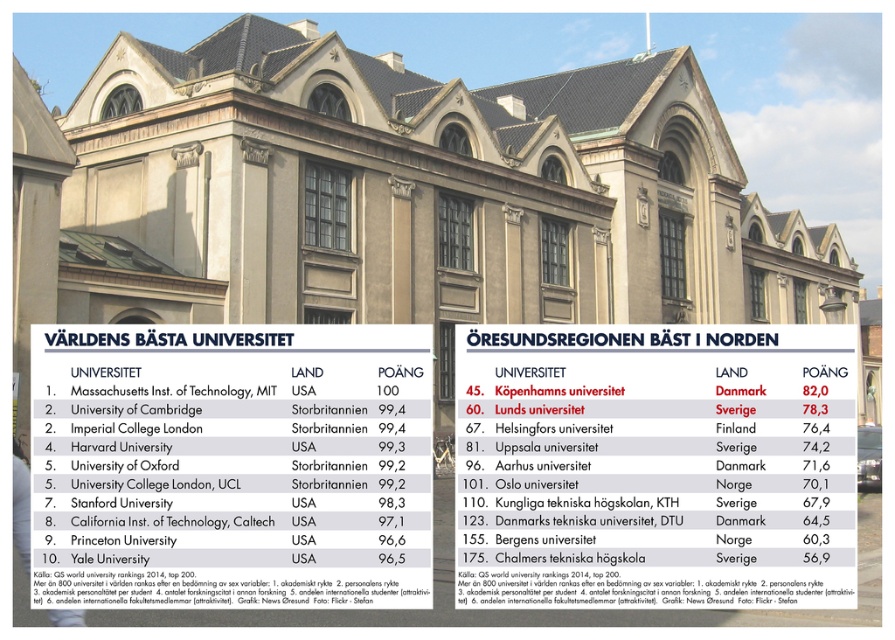
You are standing in front of the building shown in the image. You want to read the white paper menu at upper left. Is it possible to read the menu without moving closer?

The white paper menu at upper left is 22.82 meters away from viewer, so it is too far to read without moving closer.